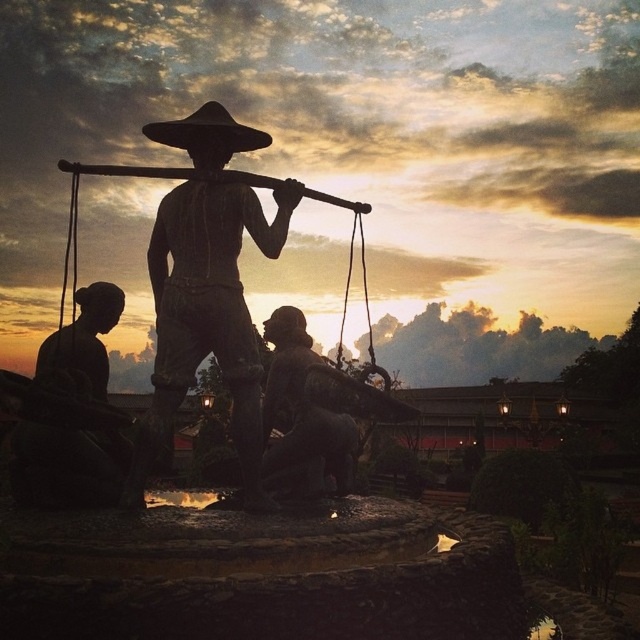
Is the position of matte bronze statue at center more distant than that of black matte cowboy hat at upper center?

No.

Who is positioned more to the right, matte bronze statue at center or black matte cowboy hat at upper center?

black matte cowboy hat at upper center

Does point (248, 493) lie in front of point (195, 120)?

Yes, it is in front of point (195, 120).

Where is `matte bronze statue at center`? Image resolution: width=640 pixels, height=640 pixels. matte bronze statue at center is located at coordinates (205, 316).